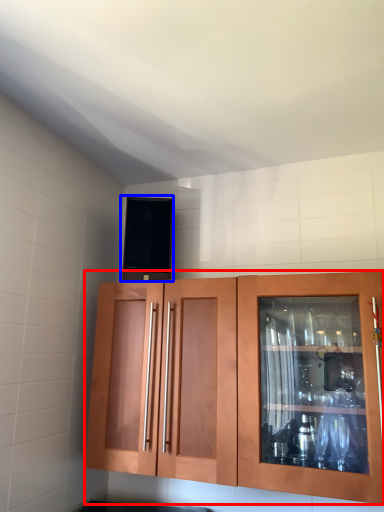
Question: Which of the following is the closest to the observer, cabinetry (highlighted by a red box) or appliance (highlighted by a blue box)?

Choices:
 (A) cabinetry
 (B) appliance

Answer: (A)